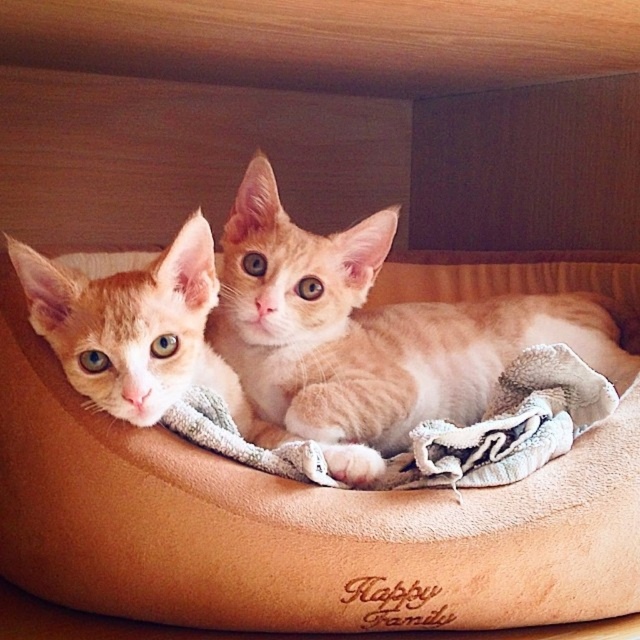
Can you confirm if orange fur cat at center is smaller than orange fur kitten at left?

No, orange fur cat at center is not smaller than orange fur kitten at left.

Which is behind, point (513, 301) or point (168, 369)?

The point (513, 301) is behind.

Is point (300, 364) positioned after point (198, 310)?

Yes, it is.

The width and height of the screenshot is (640, 640). In order to click on orange fur cat at center in this screenshot , I will do `click(371, 333)`.

Can you confirm if orange fur kitten at left is taller than gray terry cloth blanket at center?

Indeed, orange fur kitten at left has a greater height compared to gray terry cloth blanket at center.

Between point (28, 246) and point (417, 429), which one is positioned behind?

Positioned behind is point (417, 429).

Between point (198, 365) and point (516, 442), which one is positioned behind?

Positioned behind is point (198, 365).

Identify the location of orange fur kitten at left. (132, 326).

Does point (10, 513) lie behind point (65, 324)?

Yes, it is.

Is beige suede cat bed at center positioned at the back of orange fur kitten at left?

Yes, it is behind orange fur kitten at left.

Measure the distance between beige suede cat bed at center and camera.

35.46 inches

You are a GUI agent. You are given a task and a screenshot of the screen. Output one action in this format:
    pyautogui.click(x=<x>, y=<y>)
    Task: Click on the beige suede cat bed at center
    Image resolution: width=640 pixels, height=640 pixels.
    Given the screenshot: What is the action you would take?
    pyautogui.click(x=292, y=525)